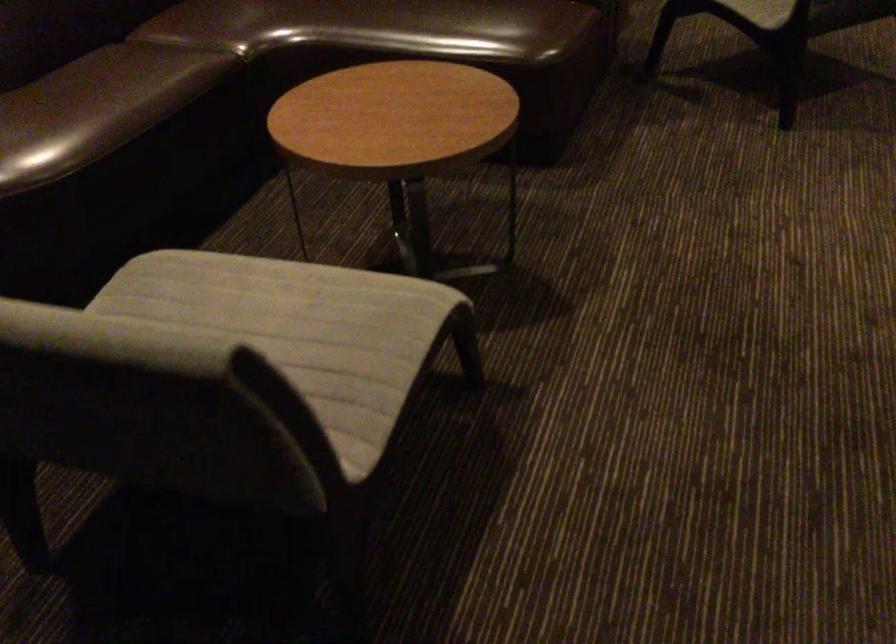
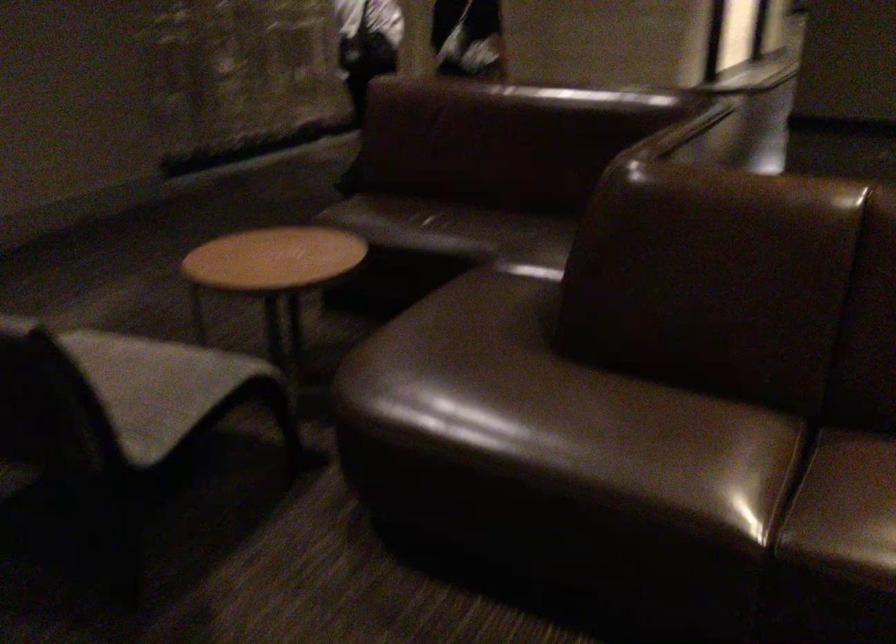
Question: What movement of the cameraman would produce the second image?

Choices:
 (A) Left
 (B) Right
 (C) Forward
 (D) Backward

Answer: (A)